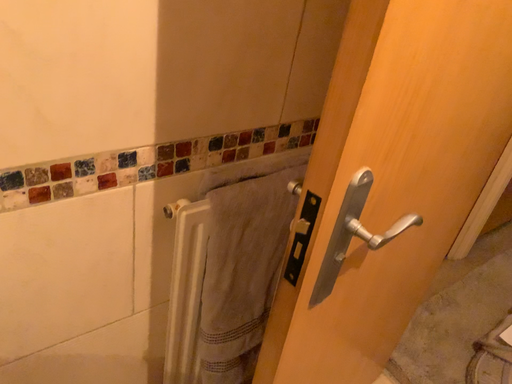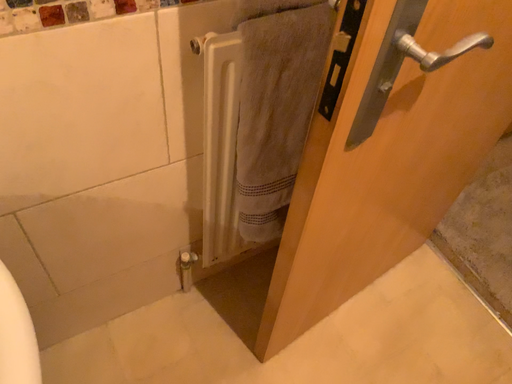
Question: Which way did the camera rotate in the video?

Choices:
 (A) rotated downward
 (B) rotated upward

Answer: (A)